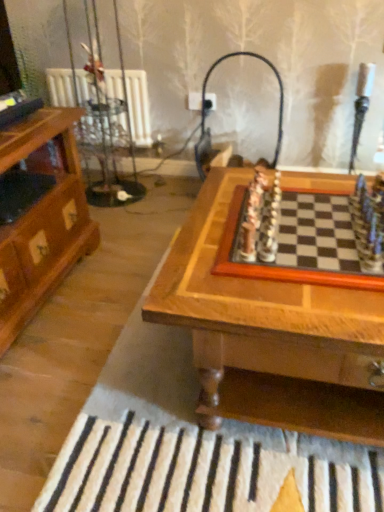
Where is `vacant space underneath wooden chessboard at center (from a real-world perspective)`? vacant space underneath wooden chessboard at center (from a real-world perspective) is located at coordinates (328, 238).